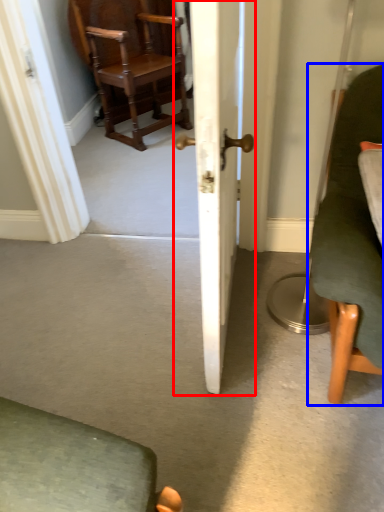
Question: Which of the following is the closest to the observer, door (highlighted by a red box) or chair (highlighted by a blue box)?

Choices:
 (A) door
 (B) chair

Answer: (A)